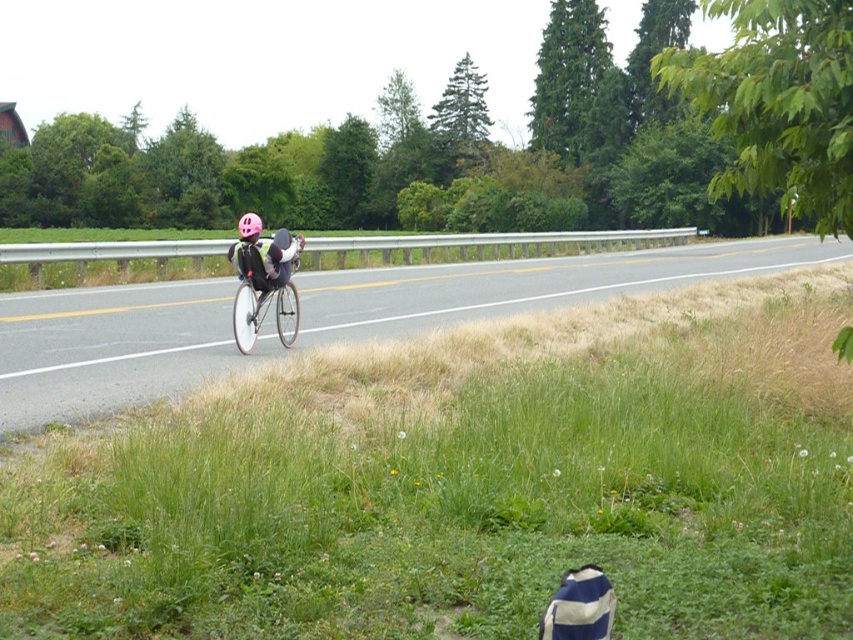
Question: Among these objects, which one is nearest to the camera?

Choices:
 (A) asphalt road at center
 (B) pink matte helmet at center
 (C) shiny silver bicycle at center

Answer: (A)

Question: Which object is positioned farthest from the shiny silver bicycle at center?

Choices:
 (A) asphalt road at center
 (B) pink matte helmet at center

Answer: (A)

Question: Which of the following is the closest to the observer?

Choices:
 (A) asphalt road at center
 (B) pink matte helmet at center

Answer: (A)

Question: Is asphalt road at center below pink matte helmet at center?

Choices:
 (A) yes
 (B) no

Answer: (A)

Question: Is shiny silver bicycle at center below pink matte helmet at center?

Choices:
 (A) yes
 (B) no

Answer: (A)

Question: Observing the image, what is the correct spatial positioning of asphalt road at center in reference to shiny silver bicycle at center?

Choices:
 (A) below
 (B) above

Answer: (B)